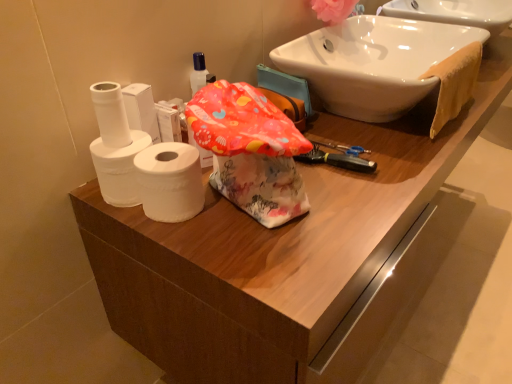
Identify the location of free space in front of white matte toilet paper at left, placed as the 2th toilet paper when sorted from left to right. The width and height of the screenshot is (512, 384). (152, 236).